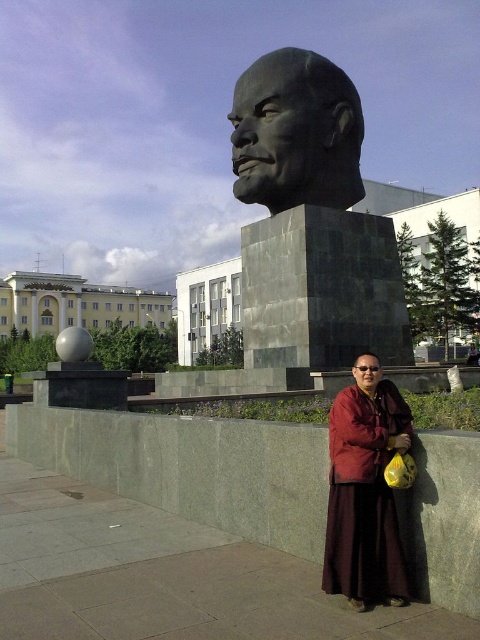
Based on the coordinates provided in the scene description, where is the dark gray stone bust at center located in the image?

The dark gray stone bust at center is located at the coordinates point (311, 220).

You are a tourist standing in the plaza and want to take a photo of both the gray stone bust at center and the bronze statue at center. Which one should you position to the left side in your camera frame to include both in the photo?

You should position the gray stone bust at center to the left side in your camera frame because it is already on the left side of the bronze statue at center in the scene.